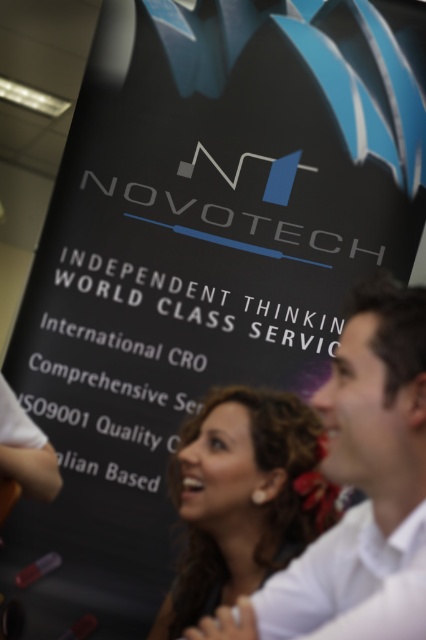
You are a visitor at a Novotech event and see two people at center, a white shirt at center and curly hair at center. Which one is more to the right?

The white shirt at center is more to the right because it is positioned on the right side of curly hair at center.

You are a photographer standing at the back of the scene. You see a white shirt at center and a curly hair at center. Which one is closer to you?

The curly hair at center is closer to you because it is located below the white shirt at center, which means it is positioned lower and nearer in the visual plane.

You are standing in front of the NOVOTECH banner and see a point marked at coordinates (x=362, y=490). Based on the scene description, where is this point located?

The point at (x=362, y=490) is located on the white shirt at center.